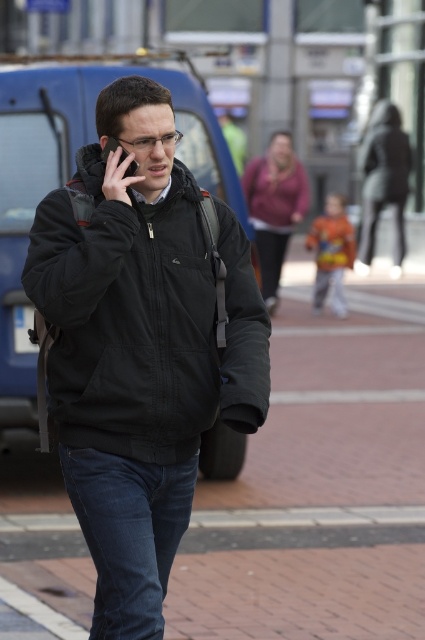
Which is more to the left, dark blue denim jeans at lower center or black matte smartphone at upper left?

black matte smartphone at upper left is more to the left.

The image size is (425, 640). In order to click on dark blue denim jeans at lower center in this screenshot , I will do `click(129, 532)`.

Is black matte jacket at center thinner than black matte ear at upper center?

In fact, black matte jacket at center might be wider than black matte ear at upper center.

Where is `black matte jacket at center`? Image resolution: width=425 pixels, height=640 pixels. black matte jacket at center is located at coordinates (146, 321).

Does dark blue denim jeans at lower center come in front of black matte ear at upper center?

Yes, dark blue denim jeans at lower center is closer to the viewer.

Find the location of a particular element. The width and height of the screenshot is (425, 640). dark blue denim jeans at lower center is located at coordinates (129, 532).

Is point (68, 449) positioned in front of point (104, 134)?

No.

Where is `dark blue denim jeans at lower center`? The height and width of the screenshot is (640, 425). dark blue denim jeans at lower center is located at coordinates (129, 532).